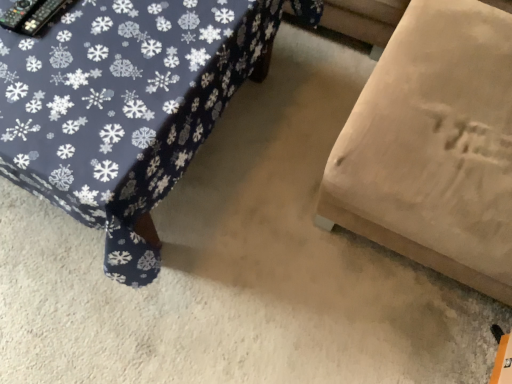
Question: From a real-world perspective, is beige fabric couch at lower right, the first furniture when ordered from left to right, beneath beige fabric ottoman at lower right, which is the second furniture from left to right?

Choices:
 (A) no
 (B) yes

Answer: (B)

Question: Is beige fabric couch at lower right, the first furniture when ordered from left to right, facing away from beige fabric ottoman at lower right, the 1th furniture viewed from the right?

Choices:
 (A) yes
 (B) no

Answer: (B)

Question: Can you confirm if beige fabric couch at lower right, arranged as the second furniture when viewed from the right, is smaller than beige fabric ottoman at lower right, which is the second furniture from left to right?

Choices:
 (A) yes
 (B) no

Answer: (A)

Question: From a real-world perspective, does beige fabric couch at lower right, the first furniture when ordered from left to right, stand above beige fabric ottoman at lower right, the 1th furniture viewed from the right?

Choices:
 (A) yes
 (B) no

Answer: (B)

Question: Could you tell me if beige fabric couch at lower right, the first furniture when ordered from left to right, is facing beige fabric ottoman at lower right, which is the second furniture from left to right?

Choices:
 (A) no
 (B) yes

Answer: (A)

Question: From the image's perspective, is beige fabric couch at lower right, arranged as the second furniture when viewed from the right, located beneath beige fabric ottoman at lower right, the 1th furniture viewed from the right?

Choices:
 (A) no
 (B) yes

Answer: (B)

Question: Is beige fabric ottoman at lower right, the 1th furniture viewed from the right, further to camera compared to beige fabric couch at lower right, arranged as the second furniture when viewed from the right?

Choices:
 (A) yes
 (B) no

Answer: (B)

Question: Is beige fabric ottoman at lower right, the 1th furniture viewed from the right, shorter than beige fabric couch at lower right, arranged as the second furniture when viewed from the right?

Choices:
 (A) no
 (B) yes

Answer: (A)

Question: Is beige fabric ottoman at lower right, which is the second furniture from left to right, smaller than beige fabric couch at lower right, arranged as the second furniture when viewed from the right?

Choices:
 (A) yes
 (B) no

Answer: (B)

Question: Considering the relative sizes of beige fabric ottoman at lower right, which is the second furniture from left to right, and beige fabric couch at lower right, arranged as the second furniture when viewed from the right, in the image provided, is beige fabric ottoman at lower right, which is the second furniture from left to right, thinner than beige fabric couch at lower right, arranged as the second furniture when viewed from the right,?

Choices:
 (A) no
 (B) yes

Answer: (B)

Question: Are beige fabric ottoman at lower right, the 1th furniture viewed from the right, and beige fabric couch at lower right, arranged as the second furniture when viewed from the right, making contact?

Choices:
 (A) yes
 (B) no

Answer: (B)

Question: From the image's perspective, is beige fabric ottoman at lower right, the 1th furniture viewed from the right, beneath beige fabric couch at lower right, arranged as the second furniture when viewed from the right?

Choices:
 (A) yes
 (B) no

Answer: (B)

Question: Considering the positions of beige fabric couch at lower right, arranged as the second furniture when viewed from the right, and beige fabric ottoman at lower right, the 1th furniture viewed from the right, in the image, is beige fabric couch at lower right, arranged as the second furniture when viewed from the right, taller or shorter than beige fabric ottoman at lower right, the 1th furniture viewed from the right,?

Choices:
 (A) short
 (B) tall

Answer: (A)